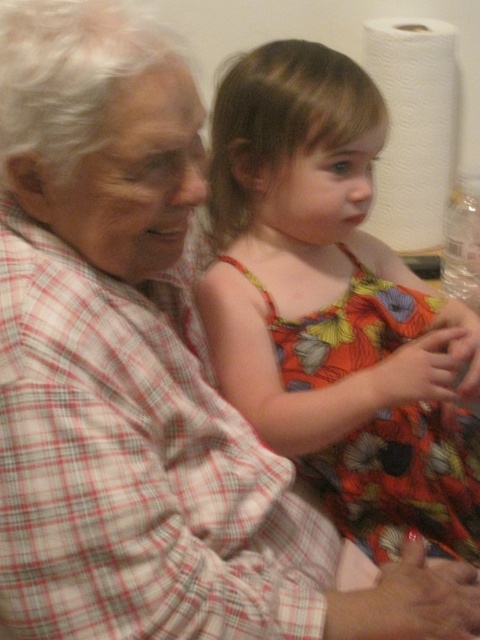
Question: Is floral fabric dress at center in front of white paper towel at upper right?

Choices:
 (A) no
 (B) yes

Answer: (B)

Question: Among these points, which one is farthest from the camera?

Choices:
 (A) (213, 353)
 (B) (439, 172)

Answer: (B)

Question: Which point is closer to the camera?

Choices:
 (A) (425, 100)
 (B) (305, 192)

Answer: (B)

Question: Which point is farther to the camera?

Choices:
 (A) floral fabric dress at center
 (B) white paper towel at upper right

Answer: (B)

Question: Does floral fabric dress at center lie behind white paper towel at upper right?

Choices:
 (A) yes
 (B) no

Answer: (B)

Question: Does floral fabric dress at center come behind white paper towel at upper right?

Choices:
 (A) no
 (B) yes

Answer: (A)